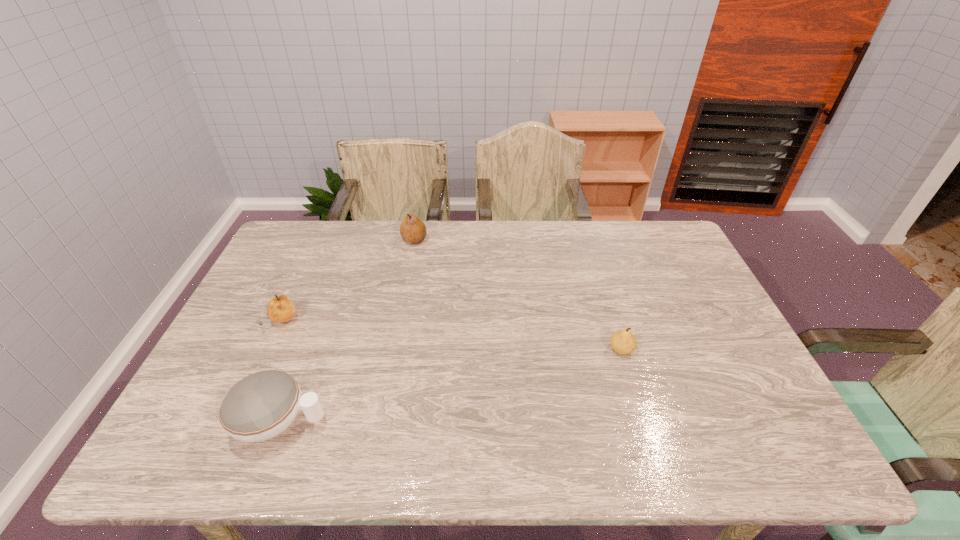
Where is `free location located on the side with the handle of the chinaware`? free location located on the side with the handle of the chinaware is located at coordinates (348, 422).

I want to click on object that is at the far edge, so click(412, 229).

Locate an element on the screen. This screenshot has height=540, width=960. object at the near edge is located at coordinates (260, 406).

The width and height of the screenshot is (960, 540). What are the coordinates of `pear that is at the left edge` in the screenshot? It's located at (280, 309).

Identify the location of chinaware that is at the left edge. The width and height of the screenshot is (960, 540). (260, 406).

Locate an element on the screen. object that is at the near left corner is located at coordinates pos(260,406).

The height and width of the screenshot is (540, 960). In the image, there is a desktop. Find the location of `free region at the far edge`. free region at the far edge is located at coordinates (569, 255).

This screenshot has height=540, width=960. What are the coordinates of `blank area at the near edge` in the screenshot? It's located at (725, 458).

Locate an element on the screen. The height and width of the screenshot is (540, 960). free spot at the right edge of the desktop is located at coordinates (716, 345).

Where is `free region at the far left corner`? The width and height of the screenshot is (960, 540). free region at the far left corner is located at coordinates (324, 234).